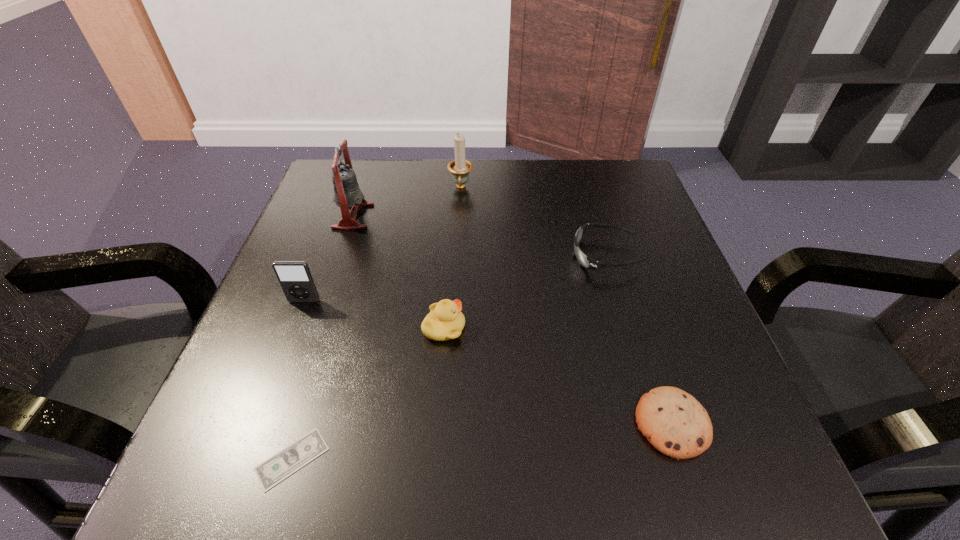
Find the location of a particular element. free space located 0.070m on the right of the money is located at coordinates (375, 459).

Where is `bell situated at the far edge`? The width and height of the screenshot is (960, 540). bell situated at the far edge is located at coordinates click(347, 193).

You are a GUI agent. You are given a task and a screenshot of the screen. Output one action in this format:
    pyautogui.click(x=<x>, y=<y>)
    Task: Click on the candle_holder at the far edge
    The image size is (960, 540).
    Given the screenshot: What is the action you would take?
    pyautogui.click(x=460, y=168)

This screenshot has width=960, height=540. What are the coordinates of `cookie located in the near edge section of the desktop` in the screenshot? It's located at (674, 422).

The width and height of the screenshot is (960, 540). I want to click on money positioned at the near edge, so click(x=278, y=467).

Image resolution: width=960 pixels, height=540 pixels. I want to click on bell that is at the left edge, so click(x=347, y=193).

Where is `iPod at the left edge`? The image size is (960, 540). iPod at the left edge is located at coordinates (296, 281).

You are a GUI agent. You are given a task and a screenshot of the screen. Output one action in this format:
    pyautogui.click(x=<x>, y=<y>)
    Task: Click on the money present at the left edge
    Image resolution: width=960 pixels, height=540 pixels.
    Given the screenshot: What is the action you would take?
    pyautogui.click(x=278, y=467)

This screenshot has width=960, height=540. What are the coordinates of `sunglasses present at the right edge` in the screenshot? It's located at (585, 261).

Where is `cookie that is positioned at the right edge`? cookie that is positioned at the right edge is located at coordinates (674, 422).